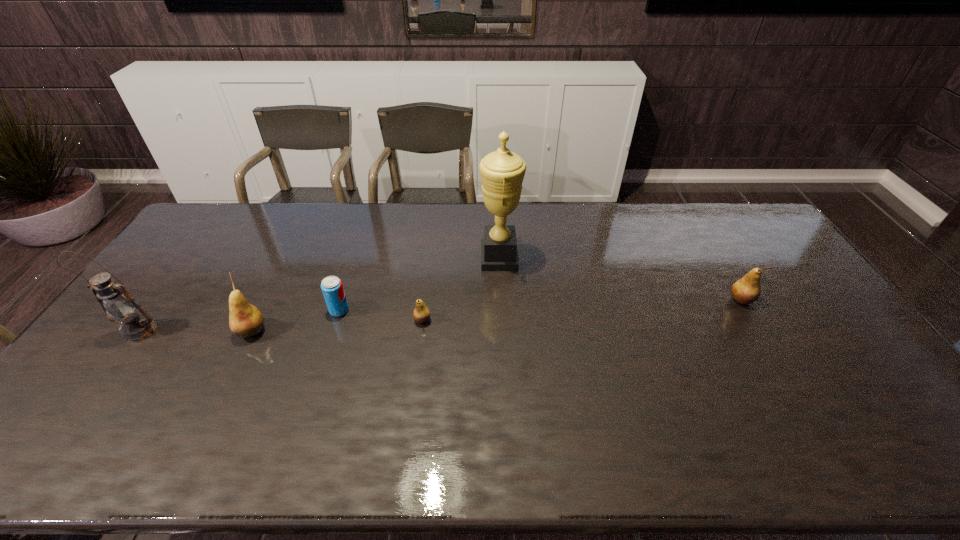
Please mark a free spot for a new pear to balance the arrangement. Please provide its 2D coordinates. Your answer should be formatted as a tuple, i.e. [(x, y)], where the tuple contains the x and y coordinates of a point satisfying the conditions above.

[(586, 310)]